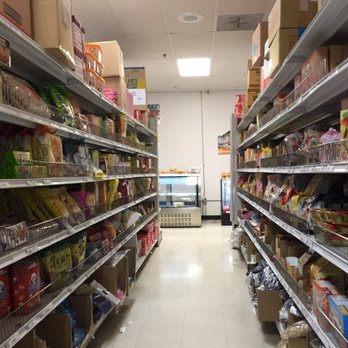
This screenshot has height=348, width=348. Find the location of `gray floor`. gray floor is located at coordinates (195, 278).